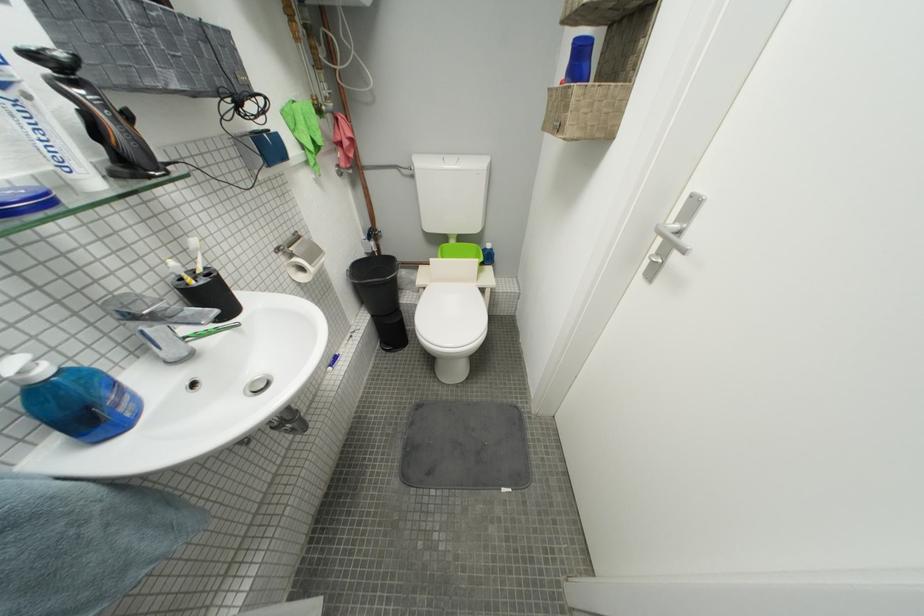
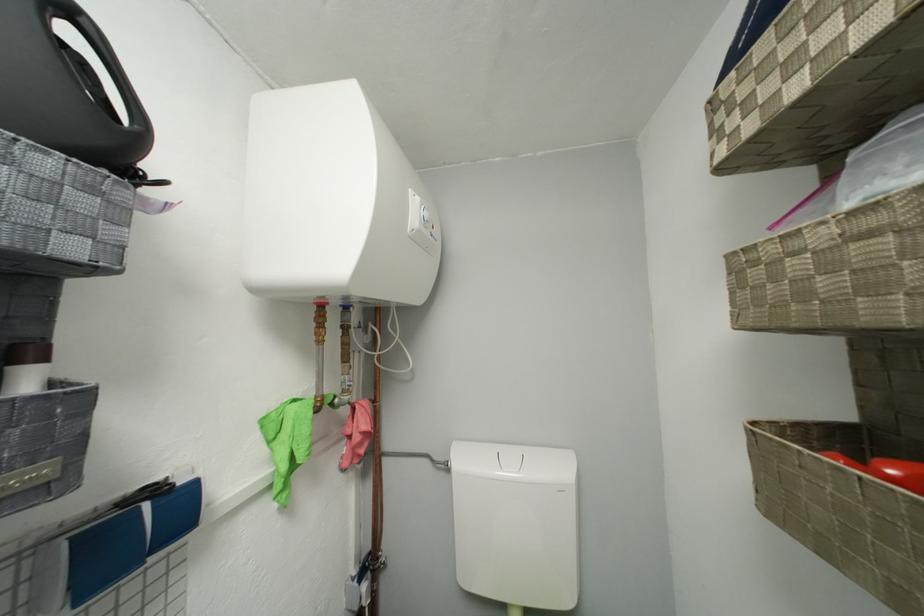
Where in the second image is the point corresponding to the point at 347,140 from the first image?

(358, 435)